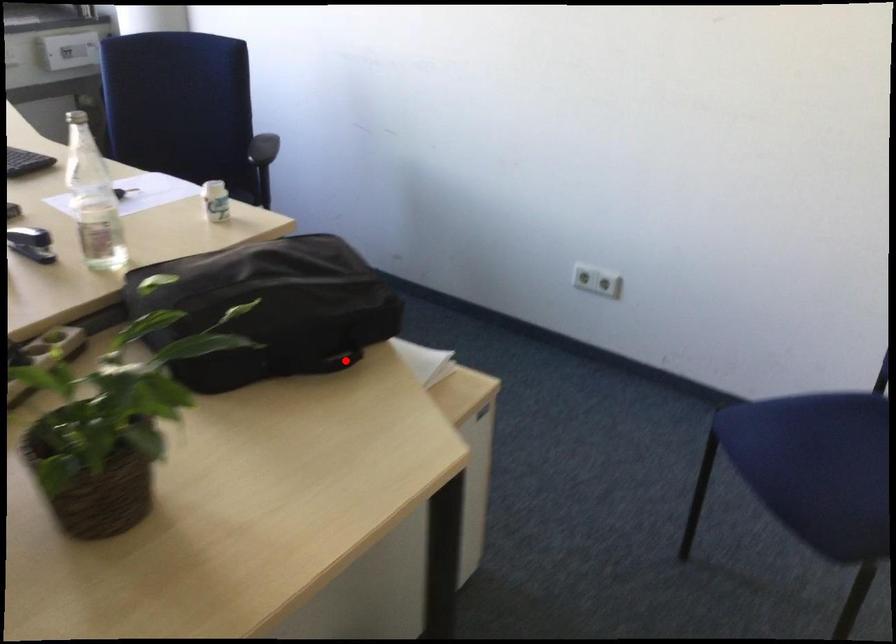
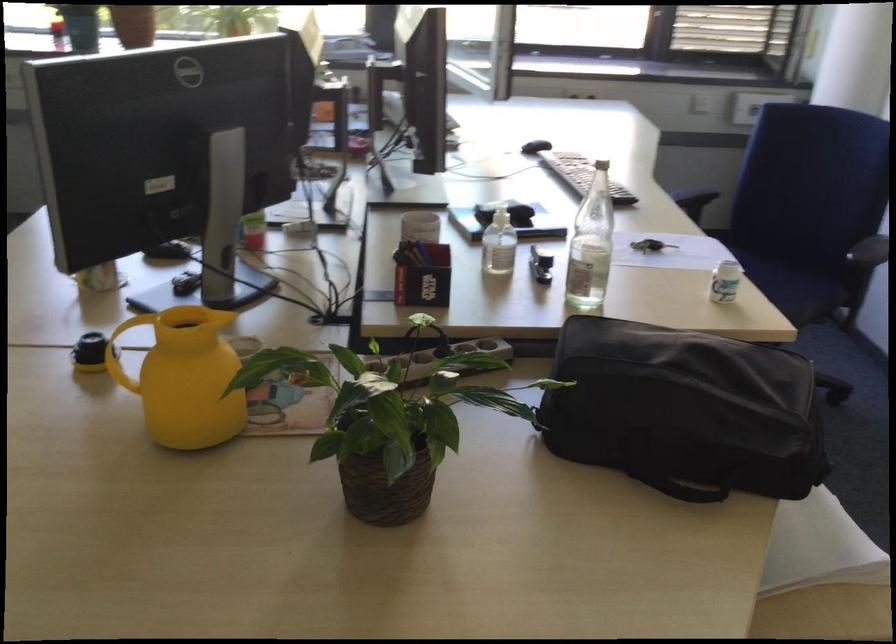
Find the pixel in the second image that matches the highlighted location in the first image.

(694, 491)